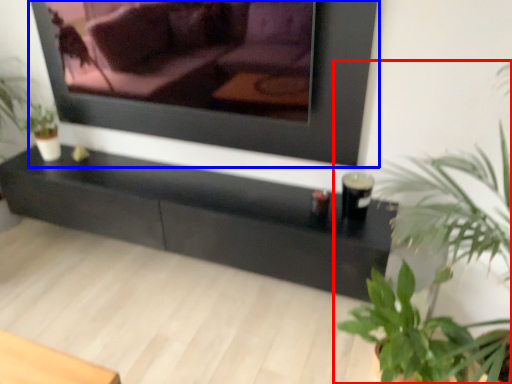
Question: Which object is closer to the camera taking this photo, houseplant (highlighted by a red box) or picture frame (highlighted by a blue box)?

Choices:
 (A) houseplant
 (B) picture frame

Answer: (A)